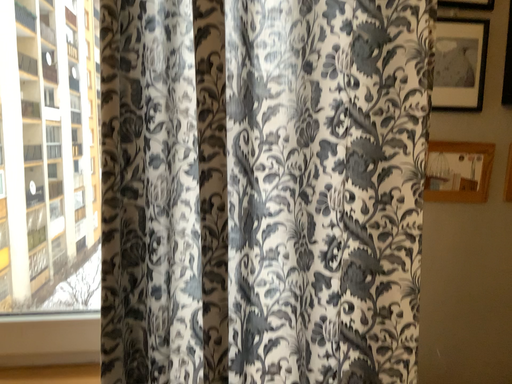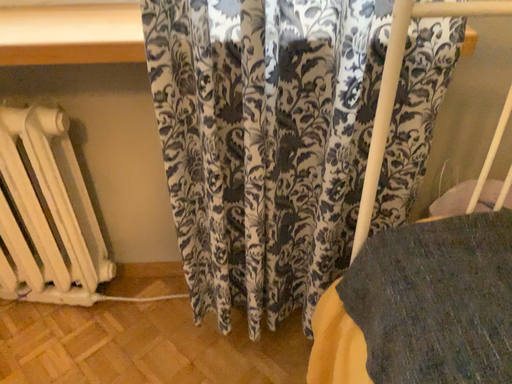
Question: How did the camera likely rotate when shooting the video?

Choices:
 (A) rotated right
 (B) rotated left

Answer: (B)